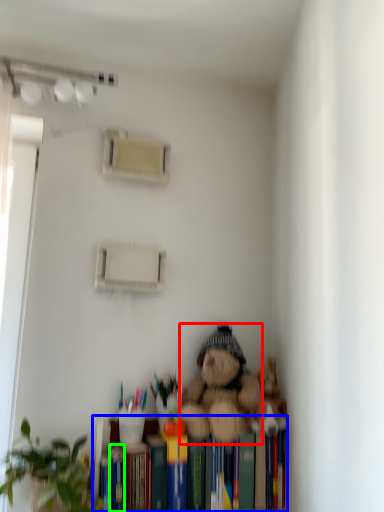
Question: Estimate the real-world distances between objects in this image. Which object is closer to teddy bear (highlighted by a red box), bookshelf (highlighted by a blue box) or paperback book (highlighted by a green box)?

Choices:
 (A) bookshelf
 (B) paperback book

Answer: (A)